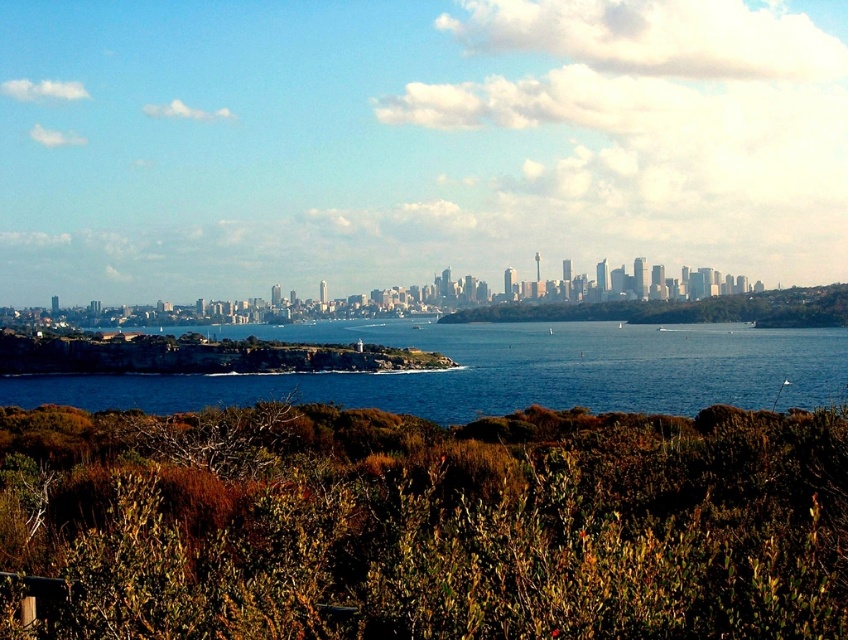
Question: Which object is closer to the camera taking this photo?

Choices:
 (A) blue water at center
 (B) green leafy shrubs at center

Answer: (A)

Question: From the image, what is the correct spatial relationship of blue water at center in relation to green leafy shrubs at center?

Choices:
 (A) below
 (B) above

Answer: (A)

Question: Can you confirm if green shrubbery at lower center is positioned below green leafy shrubs at center?

Choices:
 (A) yes
 (B) no

Answer: (A)

Question: Does blue water at center appear under green leafy shrubs at center?

Choices:
 (A) no
 (B) yes

Answer: (B)

Question: Which object appears closest to the camera in this image?

Choices:
 (A) green shrubbery at lower center
 (B) green leafy shrubs at center
 (C) blue water at center

Answer: (A)

Question: Considering the real-world distances, which object is closest to the green leafy shrubs at center?

Choices:
 (A) blue water at center
 (B) green shrubbery at lower center

Answer: (A)